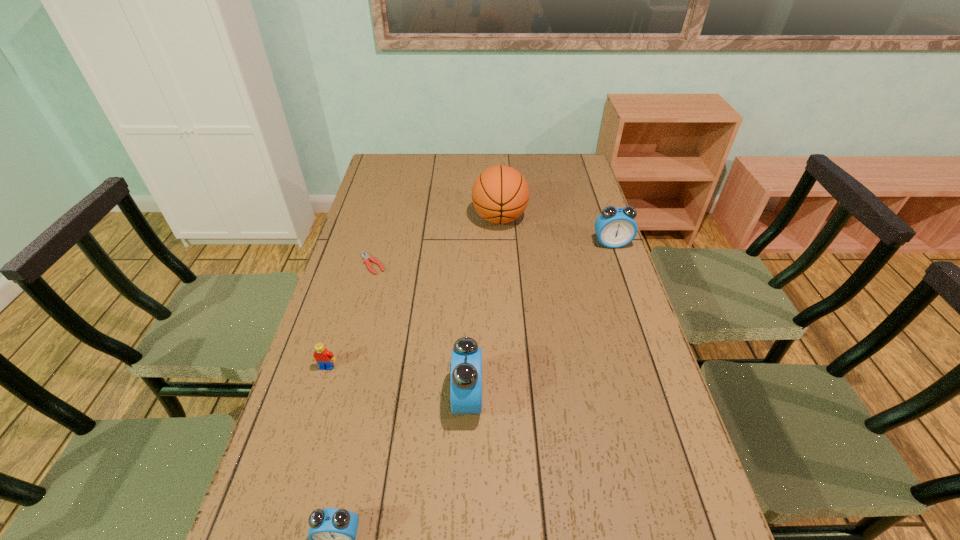
This screenshot has height=540, width=960. In order to click on vacant space that's between the second nearest object and the fourth nearest object in this screenshot , I will do `click(420, 331)`.

At what (x,y) coordinates should I click in order to perform the action: click on empty space between the shortest object and the second farthest object. Please return your answer as a coordinate pair (x, y). The image size is (960, 540). Looking at the image, I should click on (492, 254).

I want to click on blank region between the farthest object and the third tallest object, so click(556, 231).

In order to click on empty space that is in between the second alarm clock from right to left and the third nearest object in this screenshot , I will do `click(397, 383)`.

This screenshot has height=540, width=960. Identify the location of vacant space in between the Lego and the second alarm clock from right to left. (397, 383).

Locate which object ranks second in proximity to the fourth farthest object. Please provide its 2D coordinates. Your answer should be formatted as a tuple, i.e. [(x, y)], where the tuple contains the x and y coordinates of a point satisfying the conditions above.

[(366, 256)]

Find the location of a particular element. the third closest object relative to the third tallest object is located at coordinates (366, 256).

Locate which alarm clock ranks in proximity to the second farthest alarm clock. Please provide its 2D coordinates. Your answer should be formatted as a tuple, i.e. [(x, y)], where the tuple contains the x and y coordinates of a point satisfying the conditions above.

[(332, 534)]

Select which alarm clock is the closest to the shortest object. Please provide its 2D coordinates. Your answer should be formatted as a tuple, i.e. [(x, y)], where the tuple contains the x and y coordinates of a point satisfying the conditions above.

[(466, 359)]

Where is `free location that satisfies the following two spatial constraints: 1. on the face of the second shortest alarm clock; 2. on the face of the second alarm clock from right to left`? Image resolution: width=960 pixels, height=540 pixels. free location that satisfies the following two spatial constraints: 1. on the face of the second shortest alarm clock; 2. on the face of the second alarm clock from right to left is located at coordinates (665, 399).